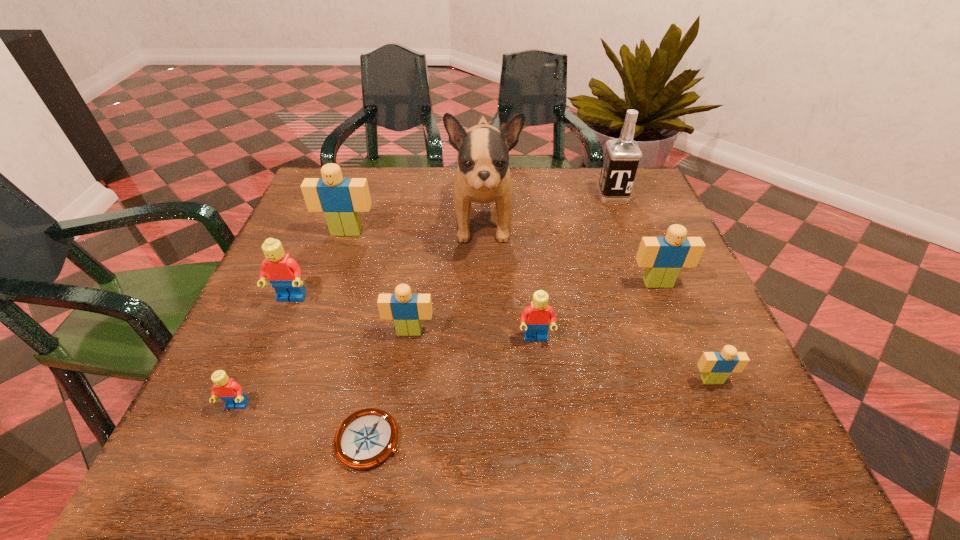
Identify which beige Lego is located as the fourth nearest to the compass. Please provide its 2D coordinates. Your answer should be formatted as a tuple, i.e. [(x, y)], where the tuple contains the x and y coordinates of a point satisfying the conditions above.

[(663, 257)]

Image resolution: width=960 pixels, height=540 pixels. Identify the location of the closest beige Lego relative to the sixth farthest Lego. coord(663,257).

Identify which red Lego is located as the second nearest to the fifth farthest object. Please provide its 2D coordinates. Your answer should be formatted as a tuple, i.e. [(x, y)], where the tuple contains the x and y coordinates of a point satisfying the conditions above.

[(536, 317)]

The width and height of the screenshot is (960, 540). I want to click on red Lego that is the closest to the shortest object, so click(227, 389).

Locate an element on the screen. Image resolution: width=960 pixels, height=540 pixels. vacant space that satisfies the following two spatial constraints: 1. on the face of the compass; 2. on the right side of the leftmost beige Lego is located at coordinates 274,440.